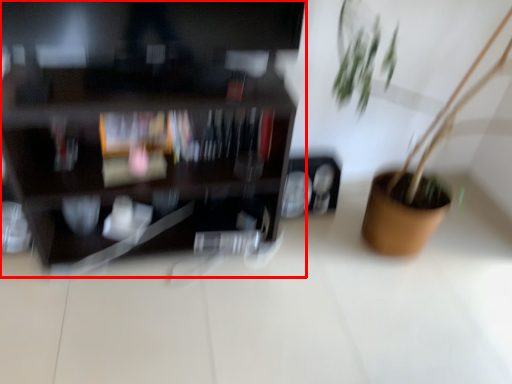
Question: From the image's perspective, where is shelf (annotated by the red box) located in relation to houseplant in the image?

Choices:
 (A) below
 (B) above

Answer: (B)